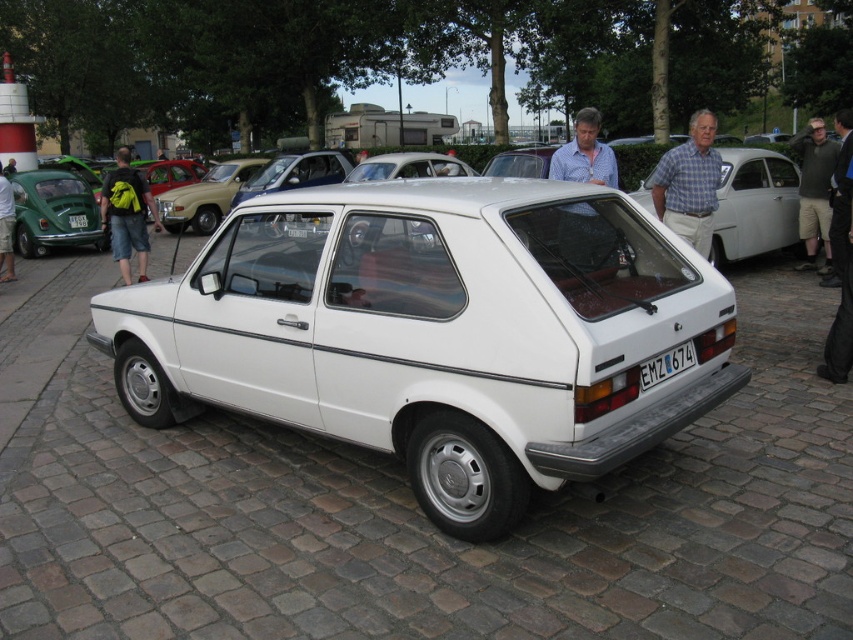
How much distance is there between blue checkered shirt at center and black leather jacket at right?

A distance of 8.37 feet exists between blue checkered shirt at center and black leather jacket at right.

Who is positioned more to the right, blue checkered shirt at center or black leather jacket at right?

black leather jacket at right is more to the right.

Is point (585, 125) in front of point (840, 125)?

Yes, point (585, 125) is in front of point (840, 125).

Identify the location of blue checkered shirt at center. The image size is (853, 640). [584, 154].

Between black leather jacket at right and matte blue shirt at center, which one appears on the left side from the viewer's perspective?

From the viewer's perspective, matte blue shirt at center appears more on the left side.

Image resolution: width=853 pixels, height=640 pixels. I want to click on black leather jacket at right, so click(x=840, y=260).

Does point (202, 179) come farther from viewer compared to point (1, 253)?

Yes.

Image resolution: width=853 pixels, height=640 pixels. Find the location of `matte beige car at center`. matte beige car at center is located at coordinates (206, 196).